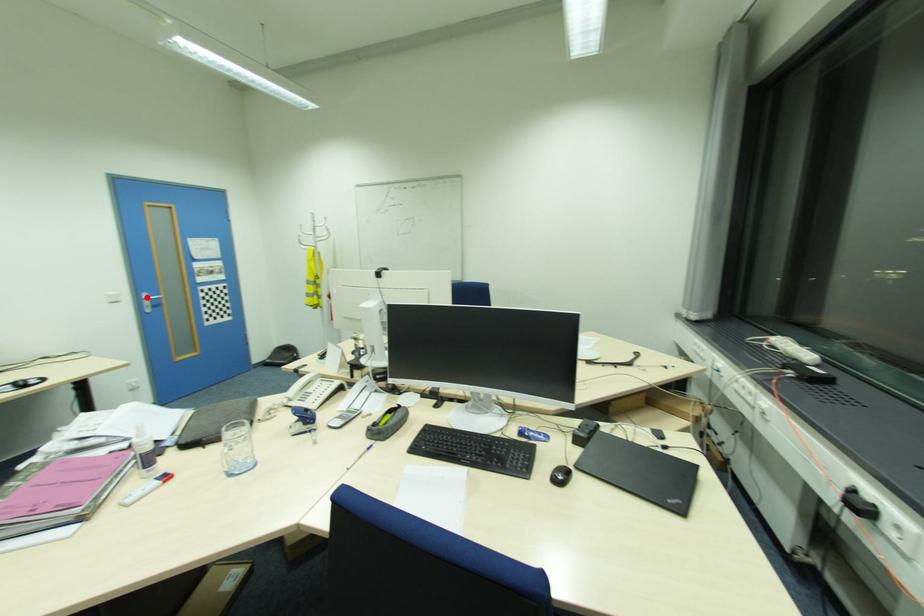
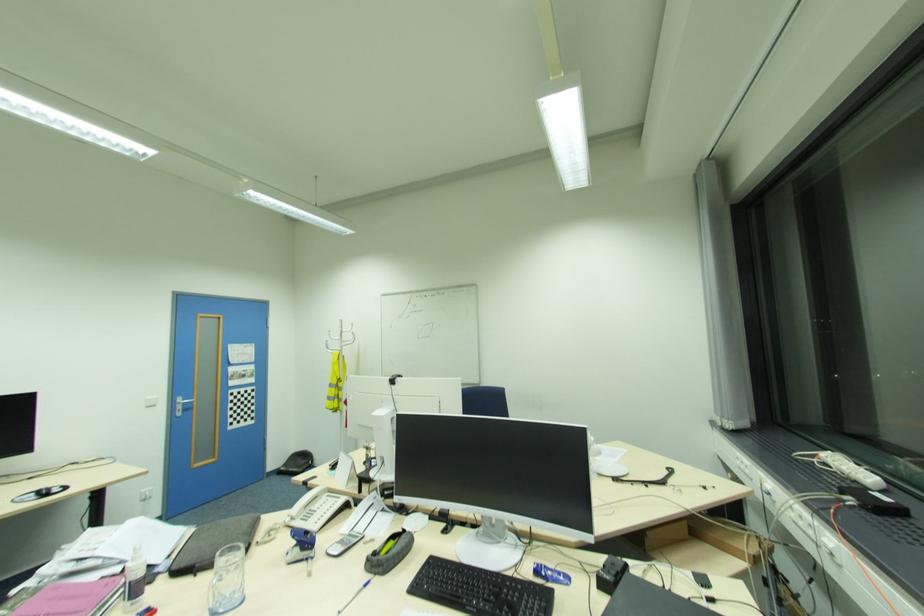
In the second image, find the point that corresponds to the highlighted location in the first image.

(180, 400)